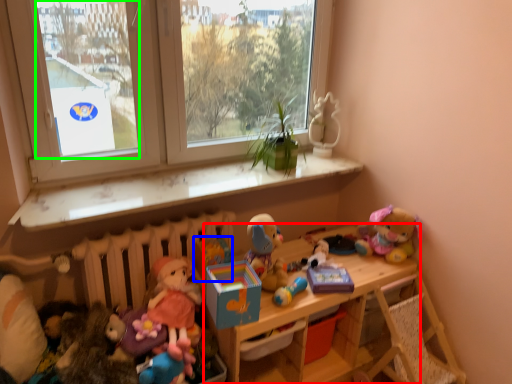
Question: Which is nearer to the shelf (highlighted by a red box)? toy (highlighted by a blue box) or window screen (highlighted by a green box).

Choices:
 (A) toy
 (B) window screen

Answer: (A)